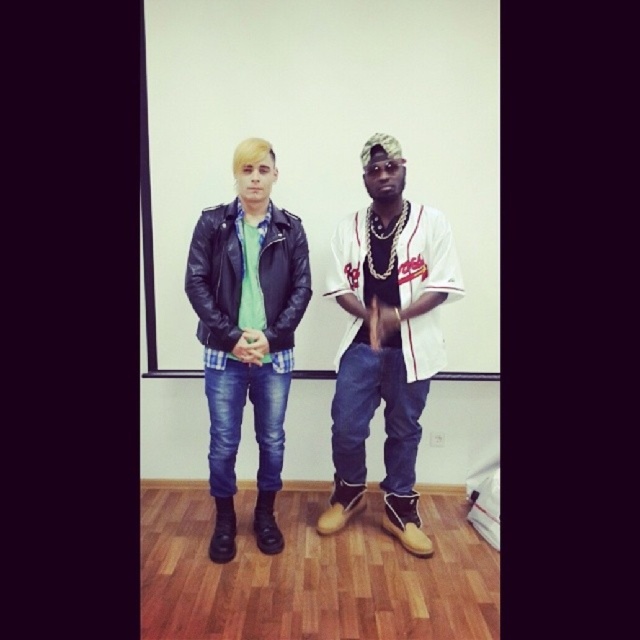
How far apart are matte black leather jacket at center and matte black leather jacket at left?

3.55 inches

Which is in front, point (232, 296) or point (269, 260)?

Point (232, 296)

Where is `matte black leather jacket at center`? The width and height of the screenshot is (640, 640). matte black leather jacket at center is located at coordinates (248, 333).

Can you confirm if leather jacket at center is shorter than matte black leather jacket at left?

In fact, leather jacket at center may be taller than matte black leather jacket at left.

Which is behind, point (346, 218) or point (221, 308)?

The point (346, 218) is more distant.

I want to click on leather jacket at center, so click(x=387, y=339).

Measure the distance between leather jacket at center and camera.

leather jacket at center is 8.07 feet away from camera.

Can you confirm if leather jacket at center is positioned to the right of matte black leather jacket at center?

Indeed, leather jacket at center is positioned on the right side of matte black leather jacket at center.

You are a GUI agent. You are given a task and a screenshot of the screen. Output one action in this format:
    pyautogui.click(x=<x>, y=<y>)
    Task: Click on the leather jacket at center
    Image resolution: width=640 pixels, height=640 pixels.
    Given the screenshot: What is the action you would take?
    pyautogui.click(x=387, y=339)